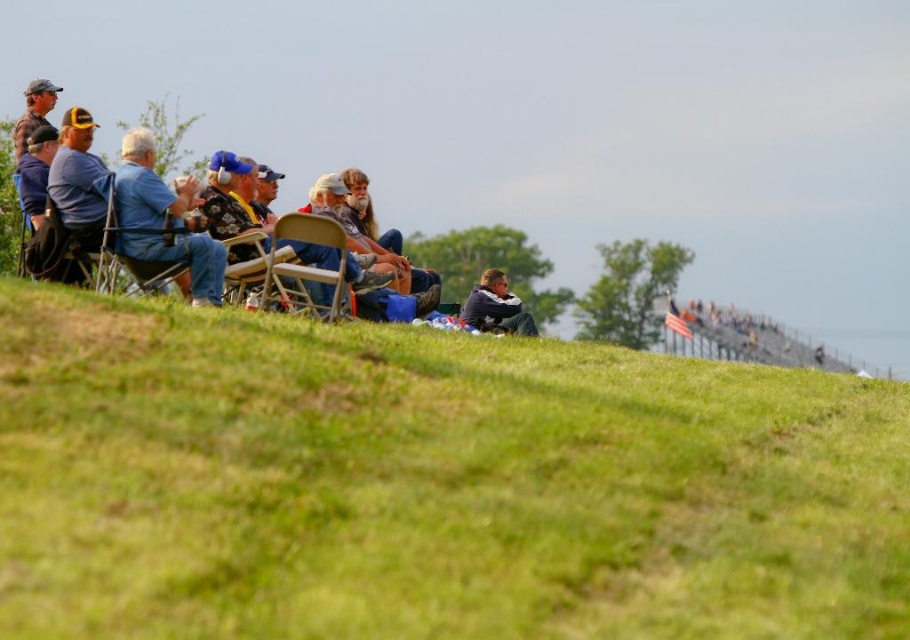
You are standing on the green grassy hillside at lower left and want to sit down on the metallic silver folding chair at center. Which direction should you move to reach it?

The green grassy hillside at lower left is positioned under the metallic silver folding chair at center, so you should move upwards to reach it.

From the picture: You are a photographer trying to capture a photo of the blue denim jeans at left and the dark blue jacket at center from the front. Which object should you focus on first if you want to ensure both are in focus?

The blue denim jeans at left is much taller than the dark blue jacket at center, so you should focus on the blue denim jeans at left first to ensure both are in focus.